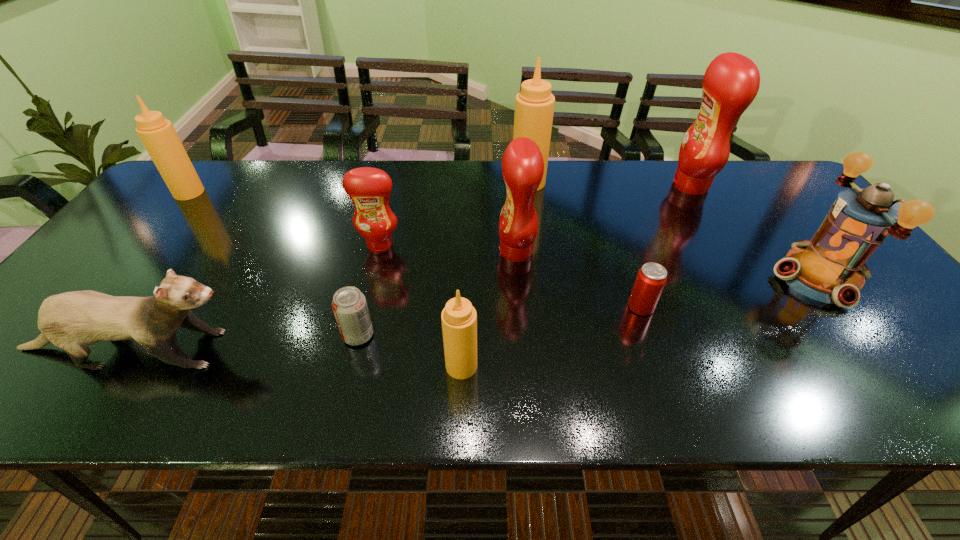
Where is `vacant space located on the label side of the second red condiment from left to right`? This screenshot has height=540, width=960. vacant space located on the label side of the second red condiment from left to right is located at coordinates (444, 251).

Where is `vacant region located on the label side of the second red condiment from left to right`? The height and width of the screenshot is (540, 960). vacant region located on the label side of the second red condiment from left to right is located at coordinates (448, 251).

Find the location of `vacant space situated on the front-facing side of the lantern`. vacant space situated on the front-facing side of the lantern is located at coordinates (687, 278).

Where is `free space located on the front-facing side of the lantern`? free space located on the front-facing side of the lantern is located at coordinates (687, 278).

Find the location of a particular element. Image resolution: width=960 pixels, height=540 pixels. free space located on the front-facing side of the lantern is located at coordinates (647, 278).

Identify the location of free space located on the label side of the leftmost red condiment. (345, 390).

Locate an element on the screen. This screenshot has height=540, width=960. free space located on the left of the sixth object from right to left is located at coordinates (334, 366).

Locate an element on the screen. free space located on the back of the soda can is located at coordinates (375, 267).

Find the location of a particular element. The image size is (960, 540). free point located 0.070m on the back of the third object from right to left is located at coordinates (631, 276).

Find the location of a particular element. object situated at the near edge is located at coordinates (459, 318).